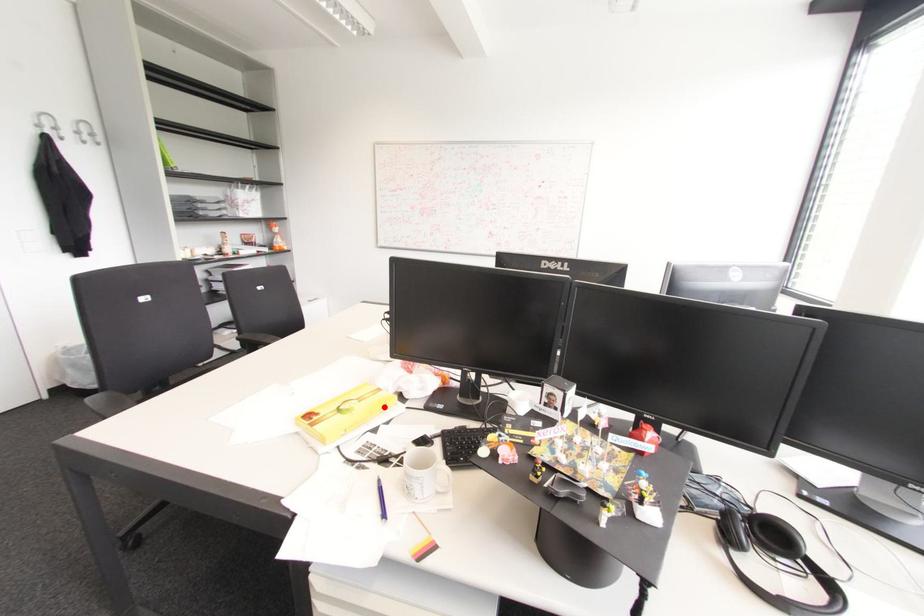
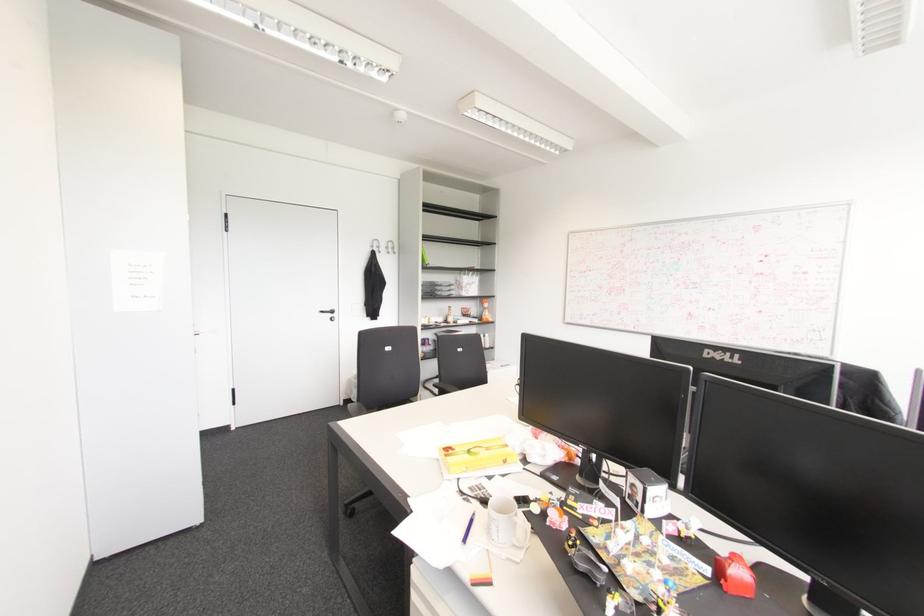
In the second image, find the point that corresponds to the highlighted location in the first image.

(504, 461)